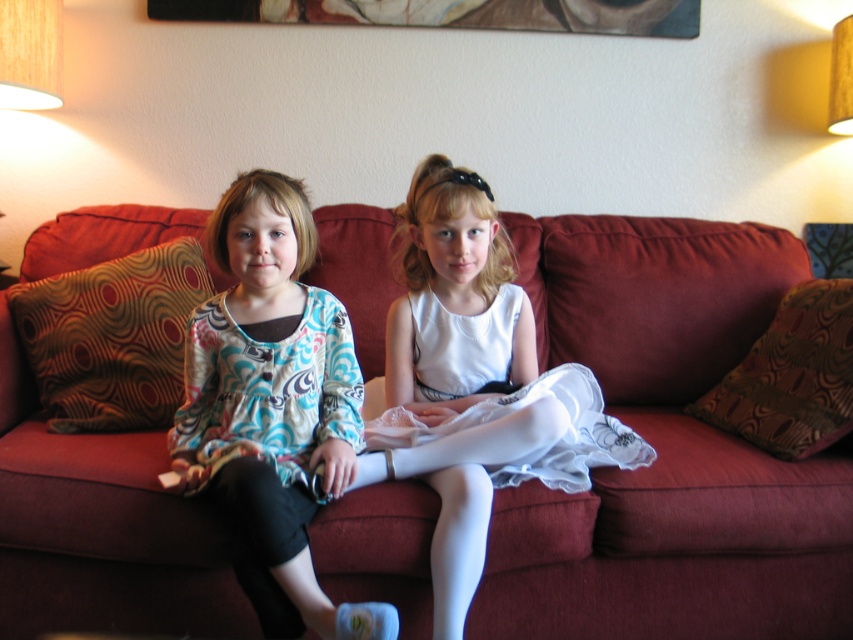
Question: Which point is closer to the camera?

Choices:
 (A) matte blue-patterned shirt at center
 (B) white satin dress at center
 (C) wooden picture frame at upper center
 (D) white lace dress at center

Answer: (A)

Question: Does white satin dress at center appear on the right side of white lace dress at center?

Choices:
 (A) yes
 (B) no

Answer: (B)

Question: Is velvet red couch at center wider than white lace dress at center?

Choices:
 (A) no
 (B) yes

Answer: (B)

Question: Among these points, which one is nearest to the camera?

Choices:
 (A) (837, 22)
 (B) (289, 426)

Answer: (B)

Question: Can you confirm if matte blue-patterned shirt at center is positioned to the right of white lace dress at center?

Choices:
 (A) yes
 (B) no

Answer: (B)

Question: Which of these objects is positioned farthest from the velvet red couch at center?

Choices:
 (A) white lace dress at center
 (B) white satin dress at center
 (C) wooden picture frame at upper center

Answer: (C)